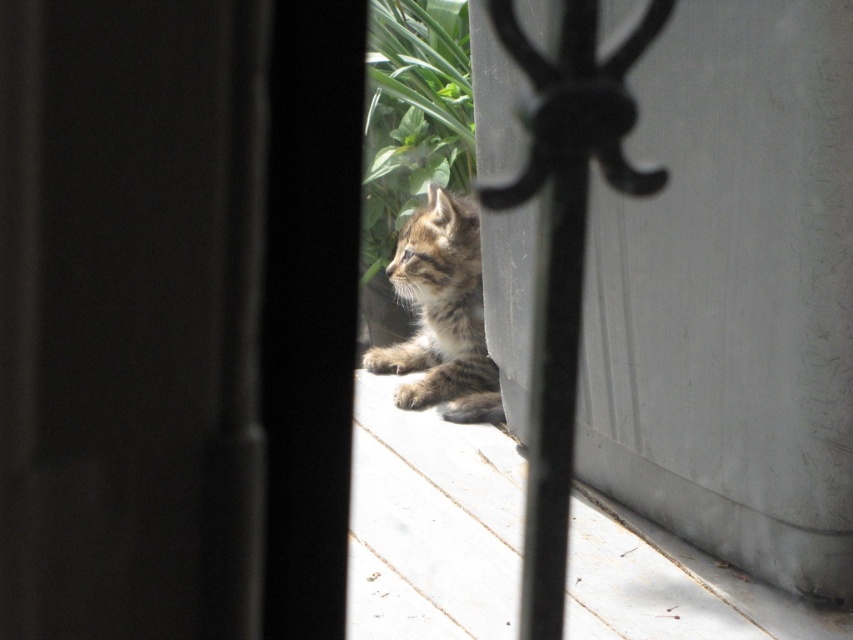
Question: Considering the real-world distances, which object is closest to the black matte screen door at center?

Choices:
 (A) white wood at lower center
 (B) striped fur kitten at lower center

Answer: (A)

Question: In this image, where is white wood at lower center located relative to striped fur kitten at lower center?

Choices:
 (A) left
 (B) right

Answer: (B)

Question: Which object is the closest to the white wood at lower center?

Choices:
 (A) green leafy plant at upper center
 (B) striped fur kitten at lower center

Answer: (B)

Question: Is white wood at lower center bigger than green leafy plant at upper center?

Choices:
 (A) no
 (B) yes

Answer: (B)

Question: Does white wood at lower center appear under green leafy plant at upper center?

Choices:
 (A) yes
 (B) no

Answer: (A)

Question: Which point appears farthest from the camera in this image?

Choices:
 (A) (454, 225)
 (B) (22, 35)
 (C) (587, 500)

Answer: (A)